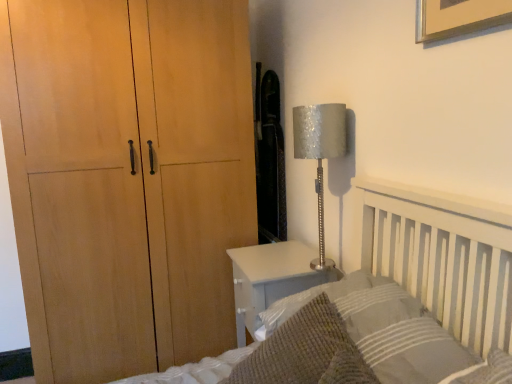
Question: Is silver textured lampshade at right outside white glossy nightstand at lower right?

Choices:
 (A) no
 (B) yes

Answer: (B)

Question: Considering the relative sizes of silver textured lampshade at right and white glossy nightstand at lower right in the image provided, is silver textured lampshade at right taller than white glossy nightstand at lower right?

Choices:
 (A) no
 (B) yes

Answer: (B)

Question: From a real-world perspective, is silver textured lampshade at right on top of white glossy nightstand at lower right?

Choices:
 (A) no
 (B) yes

Answer: (B)

Question: Is silver textured lampshade at right shorter than white glossy nightstand at lower right?

Choices:
 (A) no
 (B) yes

Answer: (A)

Question: Does silver textured lampshade at right appear on the right side of white glossy nightstand at lower right?

Choices:
 (A) no
 (B) yes

Answer: (B)

Question: From the image's perspective, relative to white glossy nightstand at lower right, is knitted wool throw pillow at lower right above or below?

Choices:
 (A) below
 (B) above

Answer: (B)

Question: In terms of height, does knitted wool throw pillow at lower right look taller or shorter compared to white glossy nightstand at lower right?

Choices:
 (A) short
 (B) tall

Answer: (A)

Question: From a real-world perspective, relative to white glossy nightstand at lower right, is knitted wool throw pillow at lower right vertically above or below?

Choices:
 (A) above
 (B) below

Answer: (A)

Question: Is knitted wool throw pillow at lower right wider or thinner than white glossy nightstand at lower right?

Choices:
 (A) thin
 (B) wide

Answer: (B)

Question: Considering the positions of knitted wool throw pillow at lower right and textured gray pillow at lower right in the image, is knitted wool throw pillow at lower right taller or shorter than textured gray pillow at lower right?

Choices:
 (A) tall
 (B) short

Answer: (A)

Question: Looking at their shapes, would you say knitted wool throw pillow at lower right is wider or thinner than textured gray pillow at lower right?

Choices:
 (A) wide
 (B) thin

Answer: (A)

Question: Is knitted wool throw pillow at lower right spatially inside textured gray pillow at lower right, or outside of it?

Choices:
 (A) outside
 (B) inside

Answer: (B)

Question: Considering the positions of point (307, 306) and point (400, 304), is point (307, 306) closer or farther from the camera than point (400, 304)?

Choices:
 (A) closer
 (B) farther

Answer: (B)

Question: Is white glossy nightstand at lower right inside or outside of knitted wool throw pillow at lower right?

Choices:
 (A) inside
 (B) outside

Answer: (B)

Question: Does point (269, 296) appear closer or farther from the camera than point (323, 377)?

Choices:
 (A) closer
 (B) farther

Answer: (B)